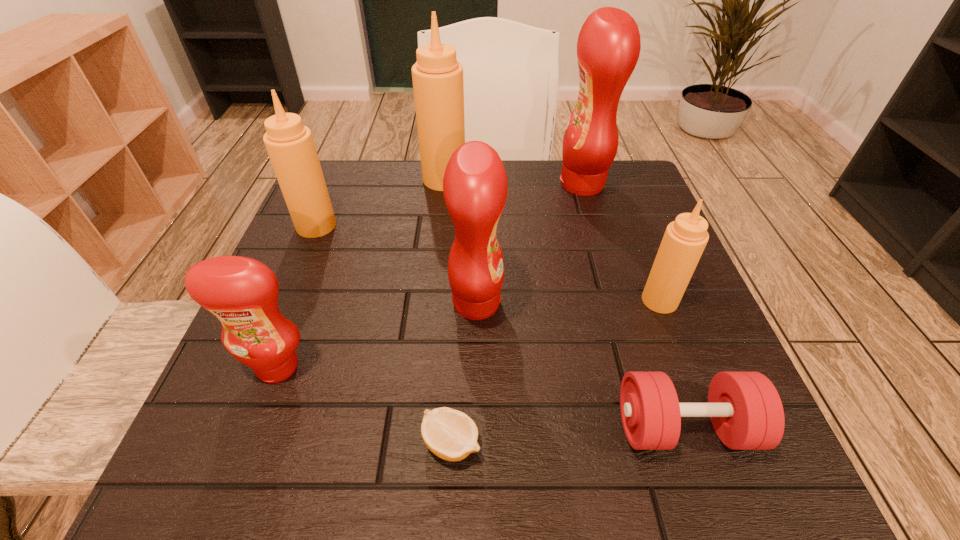
Locate an element on the screen. vacant space located 0.130m on the label side of the second red condiment from right to left is located at coordinates (573, 302).

At what (x,y) coordinates should I click in order to perform the action: click on free region located on the back of the rightmost tan condiment. Please return your answer as a coordinate pair (x, y). The height and width of the screenshot is (540, 960). Looking at the image, I should click on (623, 207).

Find the location of a particular element. vacant region located 0.150m on the label side of the nearest condiment is located at coordinates (232, 486).

In order to click on free space located 0.380m on the back of the dumbbell in this screenshot , I will do `click(618, 237)`.

Locate an element on the screen. blank space located 0.260m on the back of the shortest object is located at coordinates (459, 291).

Find the location of a particular element. dumbbell at the near edge is located at coordinates point(746,411).

At what (x,y) coordinates should I click in order to perform the action: click on lemon situated at the near edge. Please return your answer as a coordinate pair (x, y). The height and width of the screenshot is (540, 960). Looking at the image, I should click on (450, 434).

Find the location of a particular element. dumbbell located in the right edge section of the desktop is located at coordinates (746, 411).

This screenshot has height=540, width=960. I want to click on object that is positioned at the far left corner, so click(x=290, y=145).

Identify the location of object that is positioned at the far right corner. The image size is (960, 540). (608, 47).